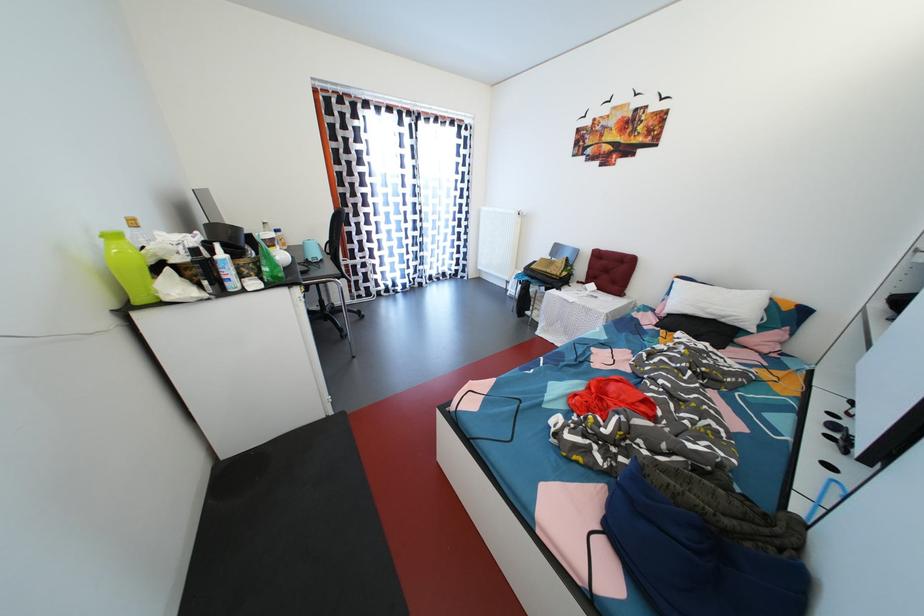
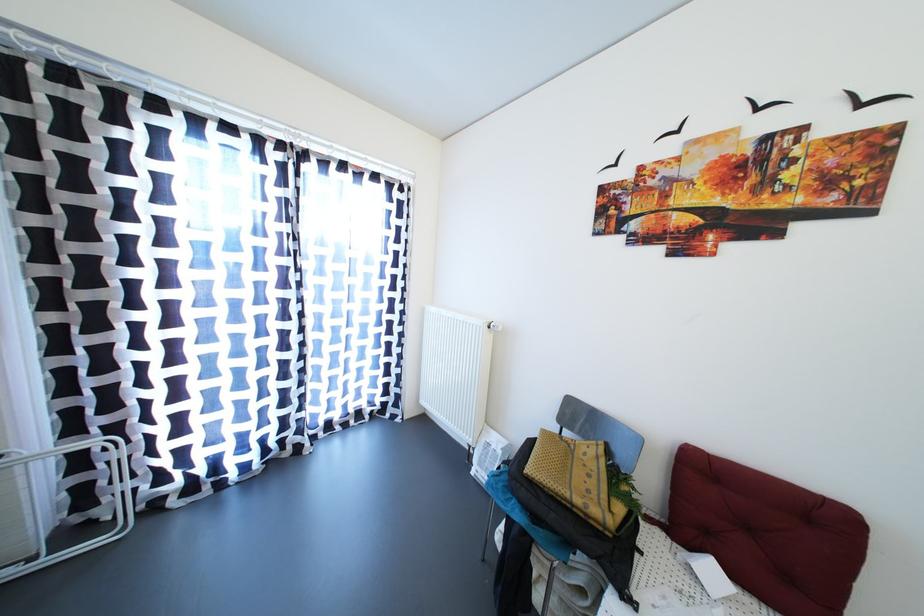
Locate, in the second image, the point that corresponds to the point at 554,276 in the first image.

(584, 506)